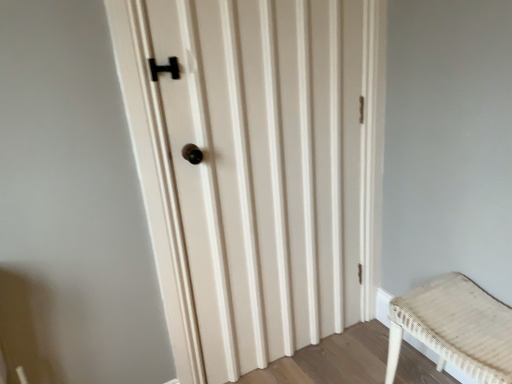
Question: Is matte wood door at center further to camera compared to woven beige bench at lower right?

Choices:
 (A) yes
 (B) no

Answer: (A)

Question: Is matte wood door at center to the right of woven beige bench at lower right from the viewer's perspective?

Choices:
 (A) yes
 (B) no

Answer: (B)

Question: Is matte wood door at center thinner than woven beige bench at lower right?

Choices:
 (A) yes
 (B) no

Answer: (A)

Question: Does matte wood door at center touch woven beige bench at lower right?

Choices:
 (A) yes
 (B) no

Answer: (B)

Question: From a real-world perspective, does matte wood door at center sit lower than woven beige bench at lower right?

Choices:
 (A) no
 (B) yes

Answer: (A)

Question: Can we say matte wood door at center lies outside woven beige bench at lower right?

Choices:
 (A) yes
 (B) no

Answer: (A)

Question: Does woven beige bench at lower right have a lesser height compared to matte wood door at center?

Choices:
 (A) yes
 (B) no

Answer: (A)

Question: Is woven beige bench at lower right not close to matte wood door at center?

Choices:
 (A) no
 (B) yes

Answer: (A)

Question: Is woven beige bench at lower right next to matte wood door at center and touching it?

Choices:
 (A) yes
 (B) no

Answer: (B)

Question: Is woven beige bench at lower right further to camera compared to matte wood door at center?

Choices:
 (A) yes
 (B) no

Answer: (B)

Question: Does woven beige bench at lower right have a larger size compared to matte wood door at center?

Choices:
 (A) yes
 (B) no

Answer: (B)

Question: From a real-world perspective, is woven beige bench at lower right positioned under matte wood door at center based on gravity?

Choices:
 (A) no
 (B) yes

Answer: (B)

Question: Is matte wood door at center to the left or to the right of woven beige bench at lower right in the image?

Choices:
 (A) right
 (B) left

Answer: (B)